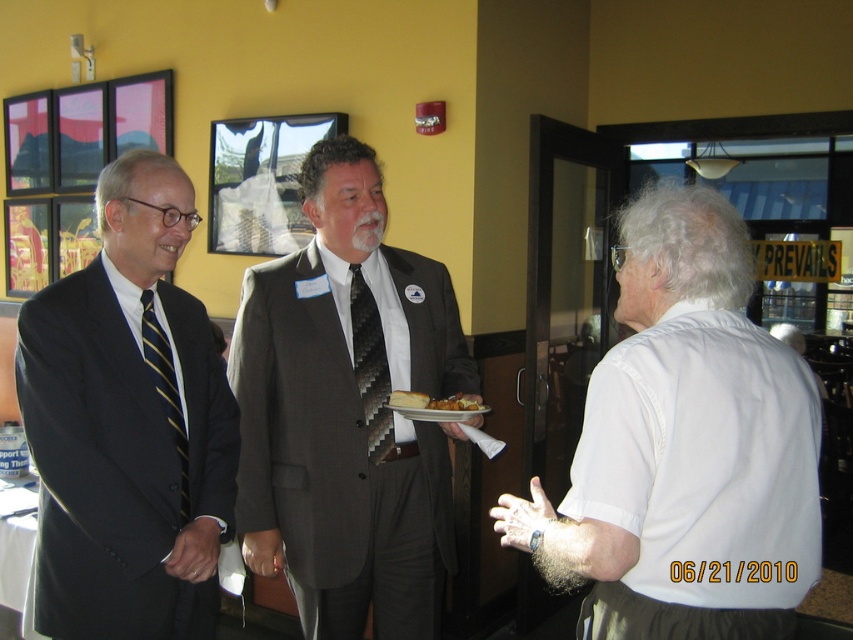
Which is below, black textured tie at center or striped silk tie at left?

striped silk tie at left is below.

Between black textured tie at center and striped silk tie at left, which one has more height?

Standing taller between the two is striped silk tie at left.

Between point (355, 349) and point (154, 365), which one is positioned in front?

Positioned in front is point (154, 365).

Find the location of `black textured tie at center`. black textured tie at center is located at coordinates (370, 368).

Is white cotton shirt at right further to the viewer compared to black textured tie at center?

No, white cotton shirt at right is closer to the viewer.

Between point (683, 449) and point (370, 314), which one is positioned behind?

The point (370, 314) is behind.

Identify the location of white cotton shirt at right. (683, 448).

What do you see at coordinates (347, 412) in the screenshot?
I see `gray suit at center` at bounding box center [347, 412].

Looking at this image, how far apart are gray suit at center and striped silk tie at left?

They are 19.05 inches apart.

Is point (430, 637) closer to camera compared to point (148, 362)?

That is False.

Where is `gray suit at center`? gray suit at center is located at coordinates (347, 412).